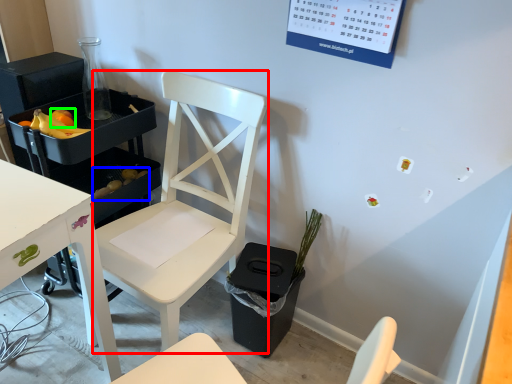
Question: Considering the real-world distances, which object is farthest from chair (highlighted by a red box)? food (highlighted by a blue box) or fruit (highlighted by a green box)?

Choices:
 (A) food
 (B) fruit

Answer: (B)